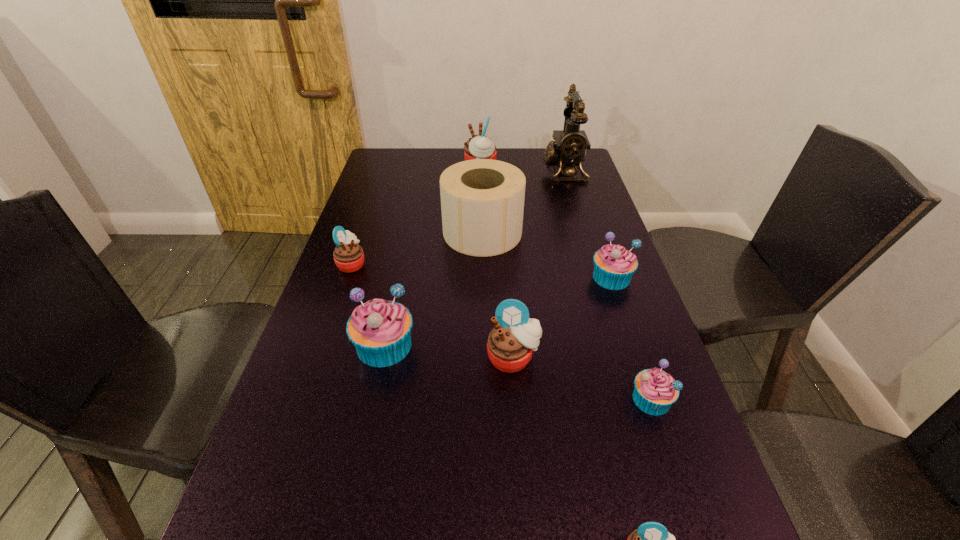
Image resolution: width=960 pixels, height=540 pixels. Identify the location of free location at the right edge. (595, 349).

Locate an element on the screen. free spot between the third farthest pink muffin and the second nearest muffin is located at coordinates (582, 379).

Find the location of `blank region between the farthest blue muffin and the smallest blue muffin`. blank region between the farthest blue muffin and the smallest blue muffin is located at coordinates (632, 339).

Image resolution: width=960 pixels, height=540 pixels. In order to click on vacant space that is in between the third farthest pink muffin and the nearest blue muffin in this screenshot , I will do `click(582, 379)`.

At what (x,y) coordinates should I click in order to perform the action: click on free space between the second nearest pink muffin and the sixth farthest muffin. Please return your answer as a coordinate pair (x, y). The width and height of the screenshot is (960, 540). Looking at the image, I should click on click(582, 379).

At what (x,y) coordinates should I click in order to perform the action: click on vacant space in between the farthest muffin and the third biggest pink muffin. Please return your answer as a coordinate pair (x, y). This screenshot has height=540, width=960. Looking at the image, I should click on (416, 215).

You are a GUI agent. You are given a task and a screenshot of the screen. Output one action in this format:
    pyautogui.click(x=<x>, y=<y>)
    Task: Click on the vacant space that's between the tallest muffin and the second nearest object
    The height and width of the screenshot is (540, 960).
    Given the screenshot: What is the action you would take?
    pyautogui.click(x=565, y=283)

Image resolution: width=960 pixels, height=540 pixels. What are the coordinates of `unoccupied area between the farthest pink muffin and the smallest blue muffin` in the screenshot? It's located at (565, 283).

Image resolution: width=960 pixels, height=540 pixels. Find the location of `object identified as the fourth closest to the biggest pink muffin`. object identified as the fourth closest to the biggest pink muffin is located at coordinates (614, 265).

Where is `object that can be found as the seventh closest to the telephone`? Image resolution: width=960 pixels, height=540 pixels. object that can be found as the seventh closest to the telephone is located at coordinates (655, 391).